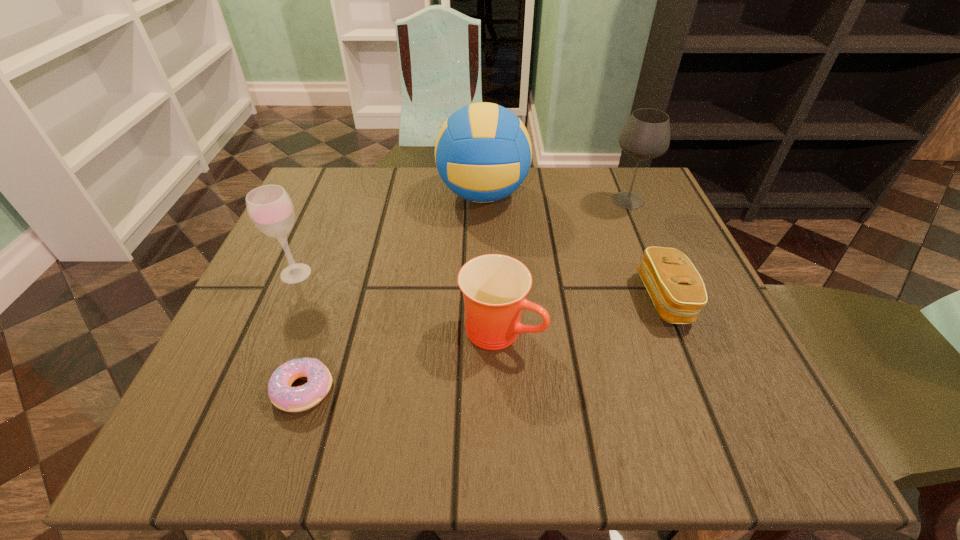
The height and width of the screenshot is (540, 960). In order to click on volleyball in this screenshot , I will do `click(483, 152)`.

Locate an element on the screen. The height and width of the screenshot is (540, 960). the right wineglass is located at coordinates (646, 135).

The width and height of the screenshot is (960, 540). I want to click on the nearer wineglass, so click(270, 208).

In order to click on the leftmost object in this screenshot , I will do `click(270, 208)`.

The height and width of the screenshot is (540, 960). I want to click on the fourth tallest object, so click(494, 286).

You are a GUI agent. You are given a task and a screenshot of the screen. Output one action in this format:
    pyautogui.click(x=<x>, y=<y>)
    Task: Click on the fifth tallest object
    Image resolution: width=960 pixels, height=540 pixels.
    Given the screenshot: What is the action you would take?
    pyautogui.click(x=677, y=290)

Where is `the nearest object`? the nearest object is located at coordinates (291, 399).

At what (x,y) coordinates should I click in order to perform the action: click on the second object from left to right. Please return your answer as a coordinate pair (x, y). Looking at the image, I should click on (291, 399).

Locate an element on the screen. The height and width of the screenshot is (540, 960). vacant space located 0.290m on the left of the volleyball is located at coordinates (313, 195).

Locate an element on the screen. The height and width of the screenshot is (540, 960). free space located on the left of the right wineglass is located at coordinates (523, 200).